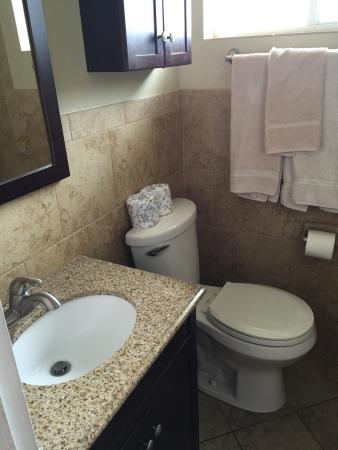
This screenshot has height=450, width=338. What are the coordinates of `mirror` in the screenshot? It's located at (23, 158).